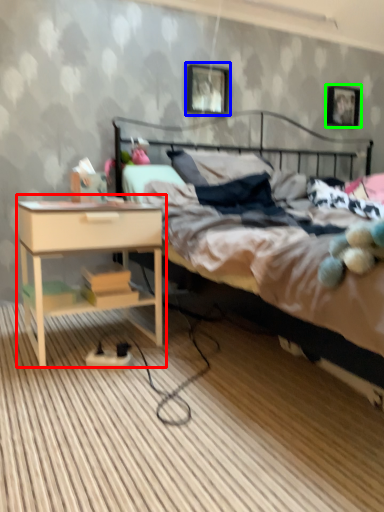
Question: Which is nearer to the nightstand (highlighted by a red box)? picture frame (highlighted by a blue box) or picture frame (highlighted by a green box).

Choices:
 (A) picture frame
 (B) picture frame

Answer: (A)